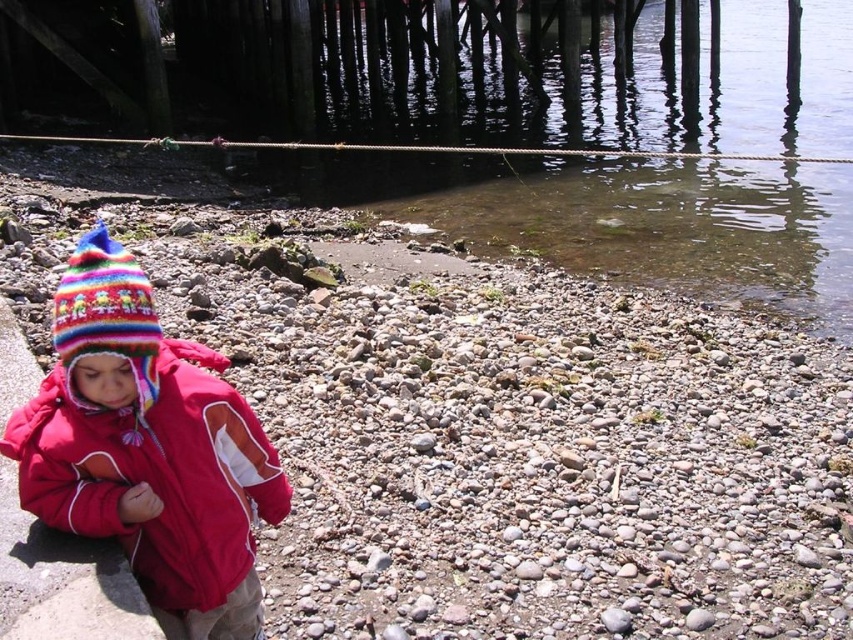
Question: Which object is farther from the camera taking this photo?

Choices:
 (A) multicolored knitted hat at left
 (B) knitted woolen hat at lower left
 (C) red fabric curb at lower left
 (D) clear water at lower center

Answer: (D)

Question: Is knitted woolen hat at lower left further to the viewer compared to red fabric curb at lower left?

Choices:
 (A) no
 (B) yes

Answer: (A)

Question: Which point is closer to the camera?

Choices:
 (A) red fabric curb at lower left
 (B) knitted woolen hat at lower left

Answer: (B)

Question: Does knitted woolen hat at lower left have a greater width compared to multicolored knitted hat at left?

Choices:
 (A) no
 (B) yes

Answer: (B)

Question: Is knitted woolen hat at lower left bigger than multicolored knitted hat at left?

Choices:
 (A) yes
 (B) no

Answer: (A)

Question: Among these points, which one is nearest to the camera?

Choices:
 (A) (73, 324)
 (B) (535, 182)
 (C) (78, 557)

Answer: (A)